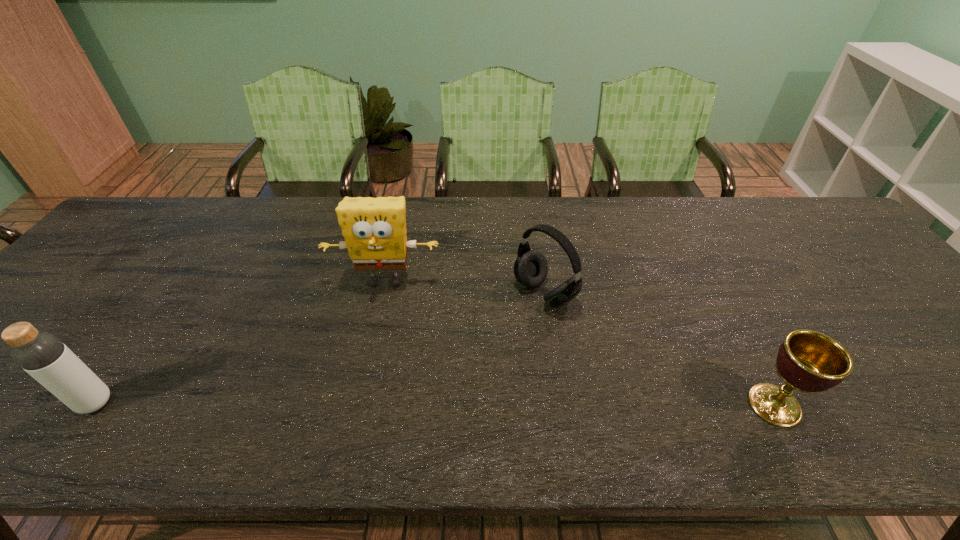
This screenshot has width=960, height=540. What are the coordinates of `vacant region located on the face of the sponge` in the screenshot? It's located at (374, 341).

At what (x,y) coordinates should I click in order to perform the action: click on vacant area located on the face of the sponge. Please return your answer as a coordinate pair (x, y). The image size is (960, 540). Looking at the image, I should click on (364, 397).

Identify the location of bottle positioned at the near edge. The image size is (960, 540). (42, 355).

Image resolution: width=960 pixels, height=540 pixels. What are the coordinates of `chalice that is at the near edge` in the screenshot? It's located at point(808,361).

The image size is (960, 540). In the image, there is a desktop. Identify the location of vacant space at the far edge. (510, 241).

This screenshot has height=540, width=960. In the image, there is a desktop. Identify the location of free region at the near edge. (262, 406).

You are a GUI agent. You are given a task and a screenshot of the screen. Output one action in this format:
    pyautogui.click(x=<x>, y=<y>)
    Task: Click on the vacant space at the right edge
    The height and width of the screenshot is (540, 960).
    Given the screenshot: What is the action you would take?
    pyautogui.click(x=921, y=357)

Where is `vacant point located between the rightmost object and the sponge`? The width and height of the screenshot is (960, 540). vacant point located between the rightmost object and the sponge is located at coordinates tap(580, 343).

The image size is (960, 540). Find the location of `blank region between the headset and the rightmost object`. blank region between the headset and the rightmost object is located at coordinates (660, 349).

This screenshot has width=960, height=540. In order to click on unoccupied area between the chalice and the sponge in this screenshot , I will do `click(580, 343)`.